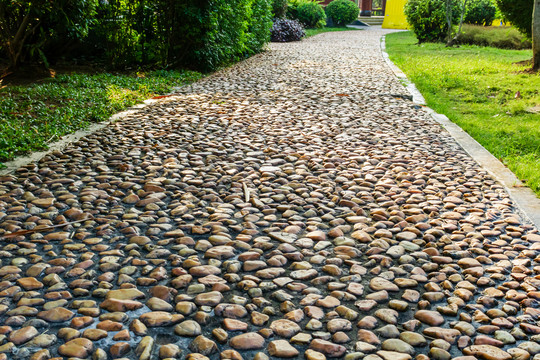
Where is `grout`? grout is located at coordinates (148, 287).